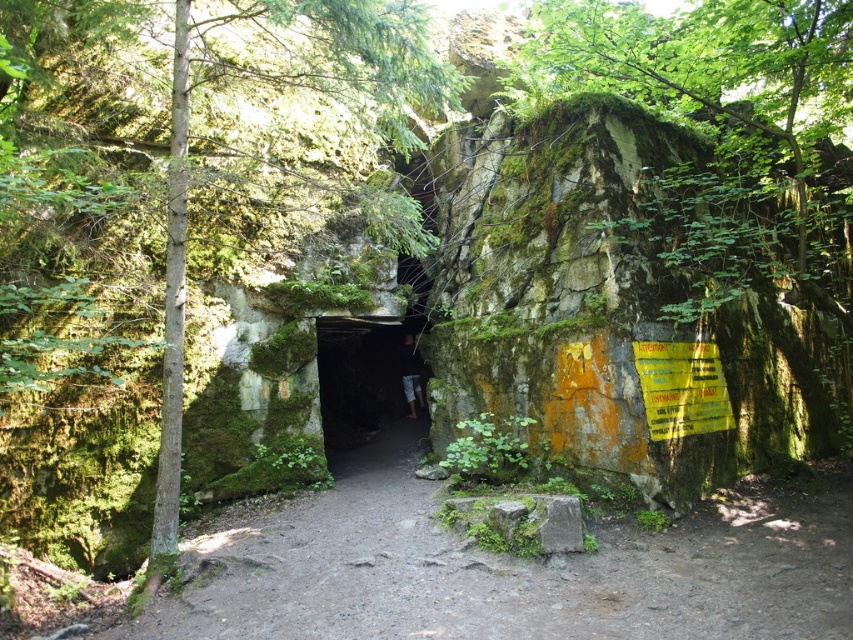
Is dirt path at center smaller than green mossy cave at center?

Correct, dirt path at center occupies less space than green mossy cave at center.

Who is more forward, (410,580) or (344,424)?

Point (410,580) is more forward.

Which is behind, point (268, 568) or point (401, 368)?

Point (401, 368)

This screenshot has height=640, width=853. Identify the location of dirt path at center. (508, 566).

Can you confirm if green mossy tree at center is positioned above dark fabric pants at center?

Correct, green mossy tree at center is located above dark fabric pants at center.

Does green mossy tree at center come in front of dark fabric pants at center?

That is True.

Which is behind, point (165, 6) or point (421, 406)?

The point (421, 406) is more distant.

I want to click on green mossy tree at center, so click(190, 248).

Who is more forward, (309, 337) or (770, 536)?

Positioned in front is point (770, 536).

Identify the location of green mossy tree at center. (190, 248).